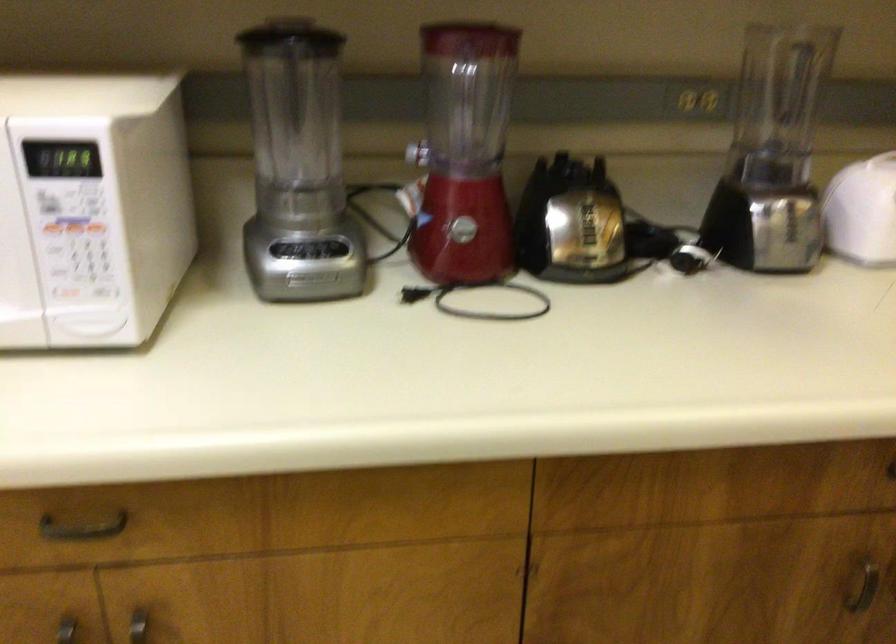
Where is `dark blender lid`? The height and width of the screenshot is (644, 896). dark blender lid is located at coordinates 580,225.